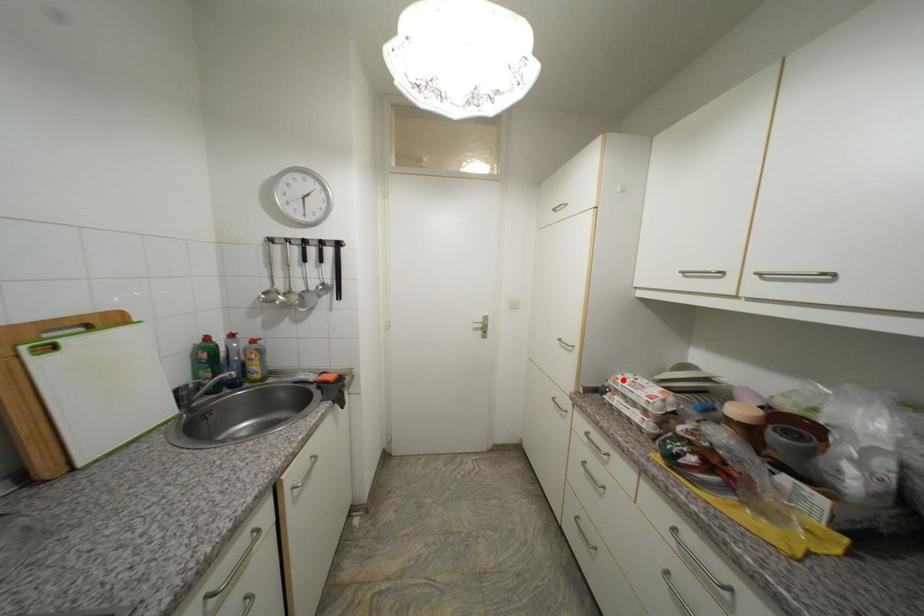
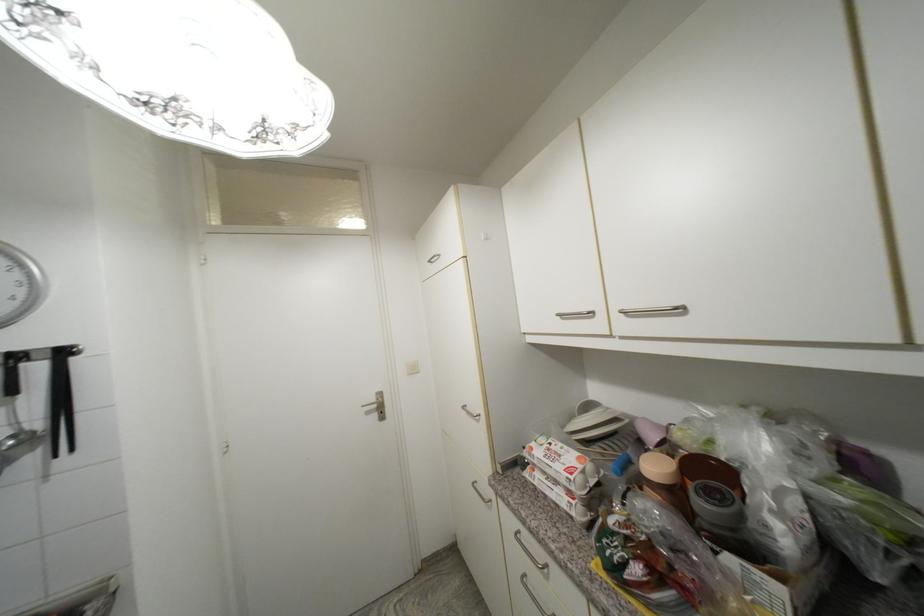
Where in the second image is the point corresponding to the highlighted location from the first image?

(537, 451)